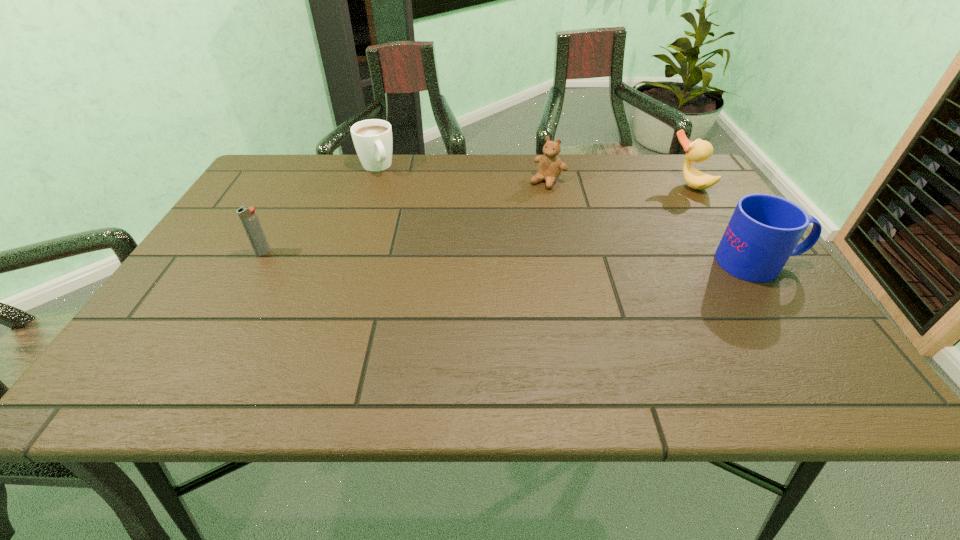
You are a GUI agent. You are given a task and a screenshot of the screen. Output one action in this format:
    pyautogui.click(x=<x>, y=<y>)
    Task: Click on the leftmost object
    This screenshot has height=540, width=960.
    Given the screenshot: What is the action you would take?
    pyautogui.click(x=248, y=216)

I want to click on mug, so click(x=764, y=230).

Find the location of a particular element. This screenshot has height=540, width=960. duck is located at coordinates (699, 150).

Find the location of a particular element. The width and height of the screenshot is (960, 540). cappuccino is located at coordinates (372, 138).

Where is `the third object from right to left`? The image size is (960, 540). the third object from right to left is located at coordinates (550, 166).

The width and height of the screenshot is (960, 540). Find the location of `vacant point located 0.200m on the right of the igniter`. vacant point located 0.200m on the right of the igniter is located at coordinates (354, 252).

I want to click on blank space located on the beak of the duck, so click(620, 227).

Find the location of a particular element. Image resolution: width=960 pixels, height=540 pixels. vacant point located on the beak of the duck is located at coordinates (620, 227).

This screenshot has width=960, height=540. I want to click on vacant region located on the beak of the duck, so click(608, 235).

In order to click on vacant space located with the handle on the side of the cappuccino in this screenshot , I will do `click(431, 252)`.